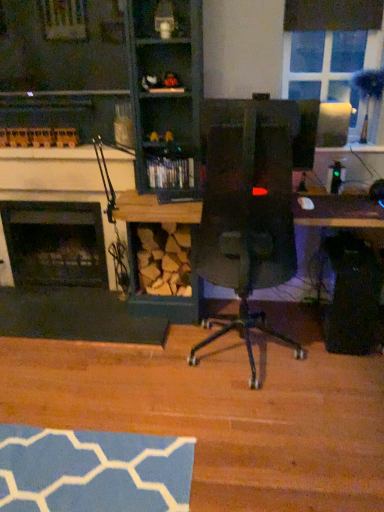
Locate an element on the screen. The width and height of the screenshot is (384, 512). spots to the right of wooden fireplace at left is located at coordinates (257, 362).